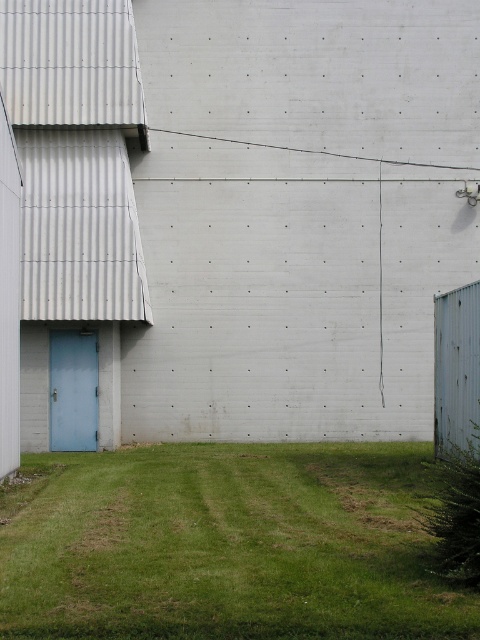
Between point (96, 541) and point (112, 364), which one is positioned in front?

Point (96, 541) is in front.

Can you confirm if green grass at lower center is smaller than light blue painted wood door at left?

No.

Who is more forward, (240,477) or (105,356)?

Positioned in front is point (240,477).

Find the location of `green grass at lower center`. green grass at lower center is located at coordinates (226, 545).

Is point (104, 326) farther from camera compared to point (63, 445)?

That is False.

Does light blue painted wood door at left have a lesser width compared to blue matte door at left?

Indeed, light blue painted wood door at left has a lesser width compared to blue matte door at left.

The height and width of the screenshot is (640, 480). What are the coordinates of `light blue painted wood door at left` in the screenshot? It's located at (35, 385).

From the picture: Does green grass at lower center appear on the left side of blue matte door at left?

Incorrect, green grass at lower center is not on the left side of blue matte door at left.

How distant is green grass at lower center from blue matte door at left?

green grass at lower center and blue matte door at left are 5.06 meters apart.

Who is more distant from viewer, [136,634] or [57,333]?

The point [57,333] is behind.

At what (x,y) coordinates should I click in order to perform the action: click on green grass at lower center. Please return your answer as a coordinate pair (x, y). The height and width of the screenshot is (640, 480). Looking at the image, I should click on (226, 545).